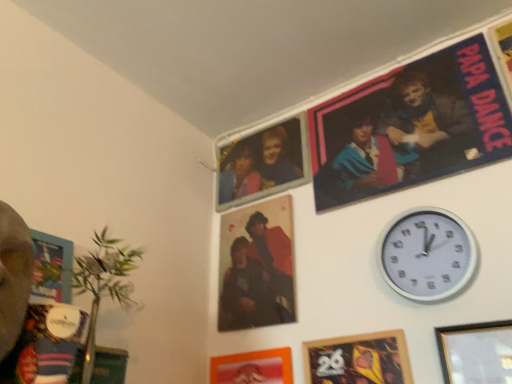
What do you see at coordinates (476, 352) in the screenshot? I see `wooden picture frame at lower right, the third picture frame positioned from the left` at bounding box center [476, 352].

Where is `wooden picture frame at lower right, placed as the 1th picture frame when sorted from right to left`? Image resolution: width=512 pixels, height=384 pixels. wooden picture frame at lower right, placed as the 1th picture frame when sorted from right to left is located at coordinates (x=476, y=352).

Where is `matte plastic photo frame at upper center`? matte plastic photo frame at upper center is located at coordinates (260, 162).

Describe the element at coordinates (253, 367) in the screenshot. I see `matte orange picture frame at lower center, arranged as the 3th picture frame when viewed from the right` at that location.

In order to click on wooden picture frame at lower right, placed as the 1th picture frame when sorted from right to left in this screenshot , I will do `click(476, 352)`.

Between matte plastic photo frame at upper center and wooden picture frame at lower right, placed as the 1th picture frame when sorted from right to left, which one has more height?

wooden picture frame at lower right, placed as the 1th picture frame when sorted from right to left.

From a real-world perspective, is matte plastic photo frame at upper center physically below wooden picture frame at lower right, placed as the 1th picture frame when sorted from right to left?

No.

Between point (226, 184) and point (447, 371), which one is positioned behind?

The point (226, 184) is more distant.

Between white plastic wall clock at upper right and matte plastic photo frame at upper center, which one has smaller size?

With smaller size is white plastic wall clock at upper right.

Considering the relative sizes of white plastic wall clock at upper right and matte plastic photo frame at upper center in the image provided, is white plastic wall clock at upper right shorter than matte plastic photo frame at upper center?

Yes, white plastic wall clock at upper right is shorter than matte plastic photo frame at upper center.

Is matte plastic photo frame at upper center a part of white plastic wall clock at upper right?

No, matte plastic photo frame at upper center is not surrounded by white plastic wall clock at upper right.

Does matte blue fabric poster at upper right appear on the left side of wooden picture frame at lower right, the third picture frame positioned from the left?

Yes.

Is matte blue fabric poster at upper right taller than wooden picture frame at lower right, the third picture frame positioned from the left?

Correct, matte blue fabric poster at upper right is much taller as wooden picture frame at lower right, the third picture frame positioned from the left.

Between point (419, 160) and point (494, 360), which one is positioned in front?

The point (494, 360) is more forward.

In order to click on movie poster located on the left of wooden picture frame at lower right, the third picture frame positioned from the left in this screenshot , I will do `click(410, 126)`.

From the image's perspective, which is above, wooden picture frame at lower right, placed as the 1th picture frame when sorted from right to left, or wooden framed poster at lower center, the second picture frame positioned from the left?

From the image's view, wooden picture frame at lower right, placed as the 1th picture frame when sorted from right to left, is above.

In the scene shown: Can you confirm if wooden picture frame at lower right, placed as the 1th picture frame when sorted from right to left, is taller than wooden framed poster at lower center, the second picture frame positioned from the left?

No, wooden picture frame at lower right, placed as the 1th picture frame when sorted from right to left, is not taller than wooden framed poster at lower center, the second picture frame positioned from the left.

Could you tell me if wooden picture frame at lower right, the third picture frame positioned from the left, is facing wooden framed poster at lower center, the second picture frame positioned from the left?

No, wooden picture frame at lower right, the third picture frame positioned from the left, is not facing towards wooden framed poster at lower center, the second picture frame positioned from the left.

Does point (422, 291) lie behind point (414, 76)?

No, it is not.

Where is `wall clock below the matte blue fabric poster at upper right (from the image's perspective)`? The image size is (512, 384). wall clock below the matte blue fabric poster at upper right (from the image's perspective) is located at coordinates (426, 254).

Is white plastic wall clock at upper right in front of or behind matte blue fabric poster at upper right in the image?

white plastic wall clock at upper right is in front of matte blue fabric poster at upper right.

From the image's perspective, relative to matte blue fabric poster at upper right, is white plastic wall clock at upper right above or below?

Based on their image positions, white plastic wall clock at upper right is located beneath matte blue fabric poster at upper right.

From the image's perspective, which is above, white plastic wall clock at upper right or wooden picture frame at lower right, placed as the 1th picture frame when sorted from right to left?

white plastic wall clock at upper right is shown above in the image.

Is white plastic wall clock at upper right surrounding wooden picture frame at lower right, placed as the 1th picture frame when sorted from right to left?

No, wooden picture frame at lower right, placed as the 1th picture frame when sorted from right to left, is not inside white plastic wall clock at upper right.

Find the location of a particular element. Image resolution: width=512 pixels, height=384 pixels. wall clock that appears behind the wooden picture frame at lower right, placed as the 1th picture frame when sorted from right to left is located at coordinates click(426, 254).

How different are the orientations of white plastic wall clock at upper right and wooden picture frame at lower right, placed as the 1th picture frame when sorted from right to left, in degrees?

0.00111 degrees.

How distant is wooden framed poster at lower center, the second picture frame positioned from the left, from wooden picture frame at lower right, placed as the 1th picture frame when sorted from right to left?

5.90 inches.

From a real-world perspective, is wooden framed poster at lower center, the second picture frame positioned from the left, physically located above or below wooden picture frame at lower right, placed as the 1th picture frame when sorted from right to left?

In terms of real-world spatial position, wooden framed poster at lower center, the second picture frame positioned from the left, is below wooden picture frame at lower right, placed as the 1th picture frame when sorted from right to left.

Considering the sizes of objects wooden framed poster at lower center, the second picture frame positioned from the left, and wooden picture frame at lower right, placed as the 1th picture frame when sorted from right to left, in the image provided, who is thinner, wooden framed poster at lower center, the second picture frame positioned from the left, or wooden picture frame at lower right, placed as the 1th picture frame when sorted from right to left,?

wooden picture frame at lower right, placed as the 1th picture frame when sorted from right to left.

How many degrees apart are the facing directions of wooden framed poster at lower center, the second picture frame positioned from the left, and wooden picture frame at lower right, placed as the 1th picture frame when sorted from right to left?

They differ by 0.000982 degrees in their facing directions.

At what (x,y) coordinates should I click in order to perform the action: click on the 2nd picture frame counting from the right side of the matte plastic photo frame at upper center. Please return your answer as a coordinate pair (x, y). The image size is (512, 384). Looking at the image, I should click on (476, 352).

Identify the location of couple above the white plastic wall clock at upper right (from the image's perspective). The height and width of the screenshot is (384, 512). (260, 162).

When comparing their distances from wooden framed poster at lower center, acting as the second picture frame starting from the right, does wooden picture frame at lower right, placed as the 1th picture frame when sorted from right to left, or white plastic wall clock at upper right seem closer?

wooden picture frame at lower right, placed as the 1th picture frame when sorted from right to left, is closer to wooden framed poster at lower center, acting as the second picture frame starting from the right.

Based on their spatial positions, is matte plastic photo frame at upper center or white plastic wall clock at upper right closer to wooden picture frame at lower right, the third picture frame positioned from the left?

white plastic wall clock at upper right is positioned closer to the anchor wooden picture frame at lower right, the third picture frame positioned from the left.

In the scene shown: Which object lies further to the anchor point matte orange picture frame at lower center, the 1th picture frame positioned from the left, wooden picture frame at lower right, placed as the 1th picture frame when sorted from right to left, or matte blue fabric poster at upper right?

Among the two, matte blue fabric poster at upper right is located further to matte orange picture frame at lower center, the 1th picture frame positioned from the left.

Which object lies nearer to the anchor point wooden framed poster at lower center, the second picture frame positioned from the left, white plastic wall clock at upper right or matte blue fabric poster at upper right?

The object closer to wooden framed poster at lower center, the second picture frame positioned from the left, is white plastic wall clock at upper right.

Which object lies further to the anchor point wooden framed poster at lower center, acting as the second picture frame starting from the right, white plastic wall clock at upper right or matte orange picture frame at lower center, arranged as the 3th picture frame when viewed from the right?

Based on the image, white plastic wall clock at upper right appears to be further to wooden framed poster at lower center, acting as the second picture frame starting from the right.

Based on the photo, which object lies nearer to the anchor point wooden framed poster at lower center, the second picture frame positioned from the left, matte blue fabric poster at upper right or white plastic wall clock at upper right?

white plastic wall clock at upper right is closer to wooden framed poster at lower center, the second picture frame positioned from the left.

From the image, which object appears to be farther from matte plastic photo frame at upper center, wooden picture frame at lower right, the third picture frame positioned from the left, or white plastic wall clock at upper right?

wooden picture frame at lower right, the third picture frame positioned from the left.

From the image, which object appears to be nearer to matte orange picture frame at lower center, the 1th picture frame positioned from the left, wooden framed poster at lower center, acting as the second picture frame starting from the right, or matte blue fabric poster at upper right?

Based on the image, wooden framed poster at lower center, acting as the second picture frame starting from the right, appears to be nearer to matte orange picture frame at lower center, the 1th picture frame positioned from the left.

In order to click on wall clock that lies between matte blue fabric poster at upper right and wooden framed poster at lower center, the second picture frame positioned from the left, from top to bottom in this screenshot , I will do `click(426, 254)`.

Identify the location of picture frame between matte blue fabric poster at upper right and wooden framed poster at lower center, the second picture frame positioned from the left, vertically. (476, 352).

Identify the location of wall clock between matte orange picture frame at lower center, the 1th picture frame positioned from the left, and wooden picture frame at lower right, placed as the 1th picture frame when sorted from right to left, from left to right. The image size is (512, 384). (426, 254).

Find the location of a particular element. The height and width of the screenshot is (384, 512). wall clock that lies between matte plastic photo frame at upper center and matte orange picture frame at lower center, the 1th picture frame positioned from the left, from top to bottom is located at coordinates (426, 254).